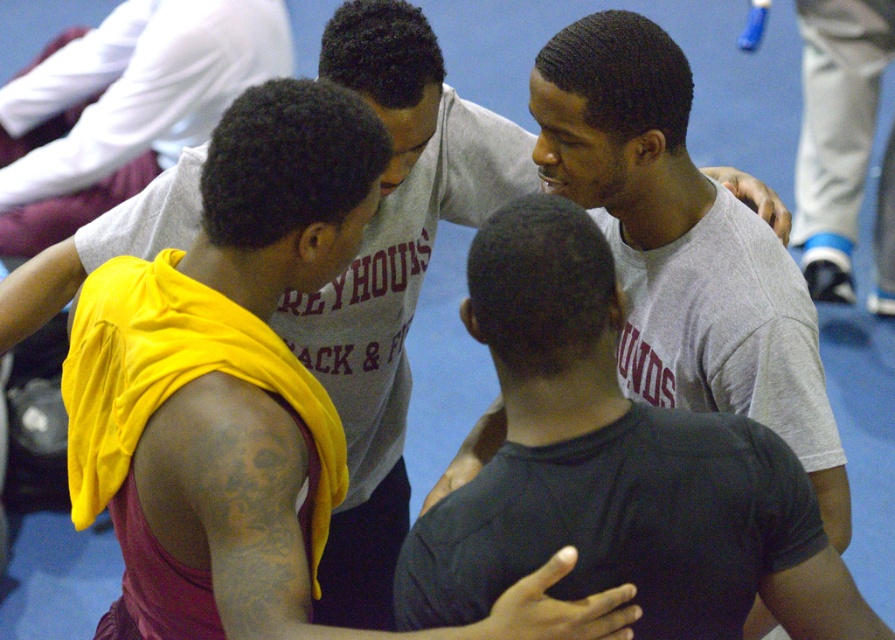
Is yellow fabric at left behind gray fabric shoe at right?

That is False.

Does yellow fabric at left have a larger size compared to gray fabric shoe at right?

Yes.

Between point (188, 1) and point (804, 164), which one is positioned in front?

Positioned in front is point (188, 1).

Where is `yellow fabric at left`? The width and height of the screenshot is (895, 640). yellow fabric at left is located at coordinates coord(126,106).

Is gray matte t-shirt at center taller than gray fabric shoe at right?

No, gray matte t-shirt at center is not taller than gray fabric shoe at right.

Does gray matte t-shirt at center come behind gray fabric shoe at right?

No, it is not.

In order to click on gray matte t-shirt at center in this screenshot , I will do `click(609, 467)`.

This screenshot has width=895, height=640. Identify the location of gray matte t-shirt at center. (609, 467).

Is gray matte t-shirt at center closer to the viewer compared to yellow fabric at left?

Yes, it is.

Does gray matte t-shirt at center appear on the left side of yellow fabric at left?

No, gray matte t-shirt at center is not to the left of yellow fabric at left.

Is point (518, 276) more distant than point (50, 168)?

No, it is in front of (50, 168).

At what (x,y) coordinates should I click in order to perform the action: click on gray matte t-shirt at center. Please return your answer as a coordinate pair (x, y). The height and width of the screenshot is (640, 895). Looking at the image, I should click on (609, 467).